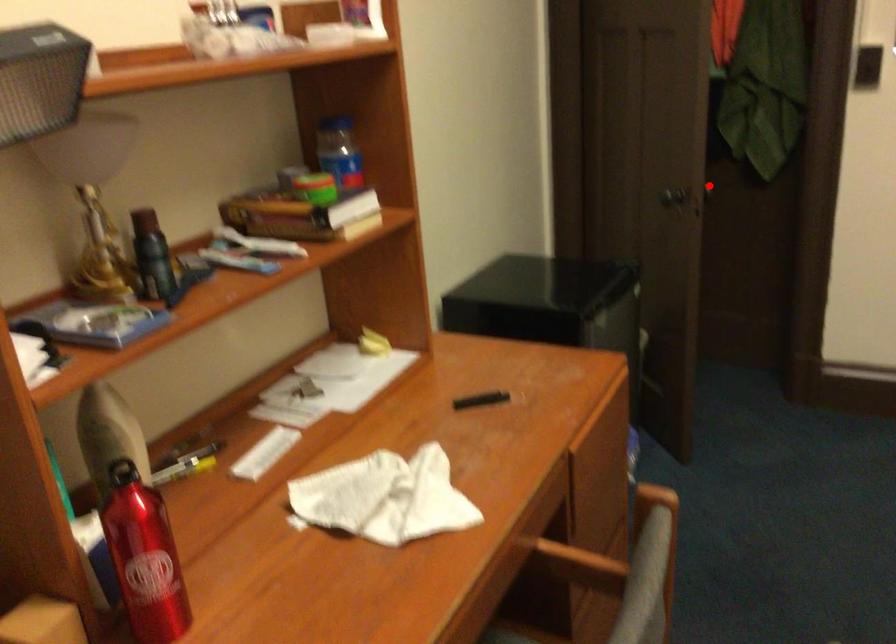
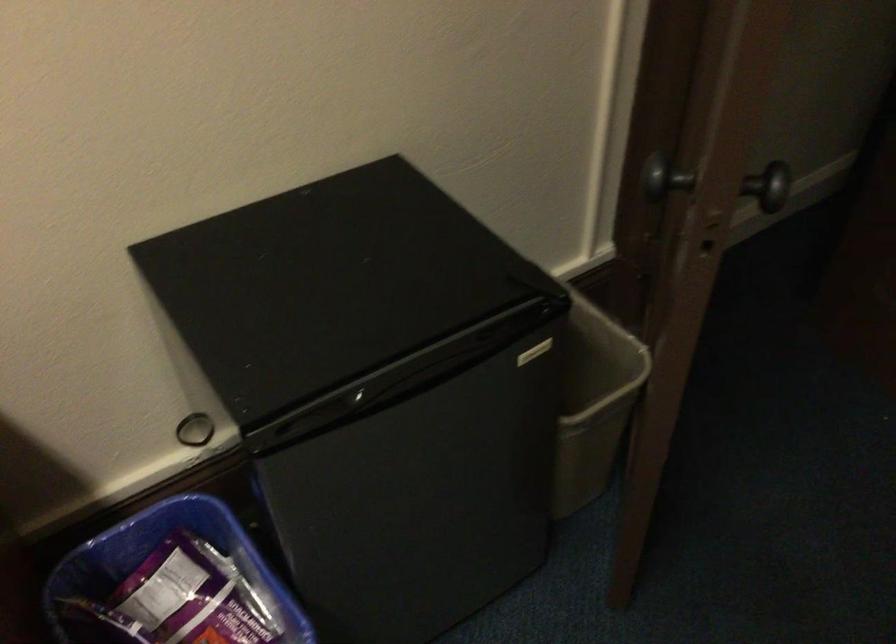
In the second image, find the point that corresponds to the highlighted location in the first image.

(771, 185)